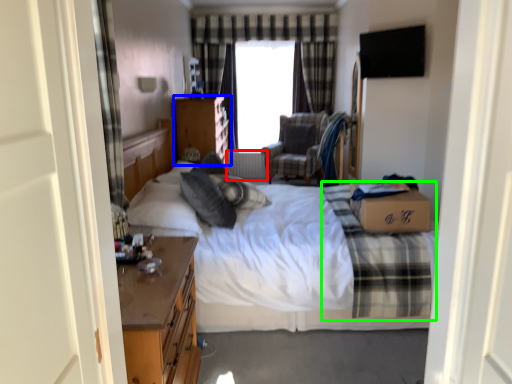
Question: Considering the real-world distances, which object is closest to radiator (highlighted by a red box)? chest of drawers (highlighted by a blue box) or plaid (highlighted by a green box).

Choices:
 (A) chest of drawers
 (B) plaid

Answer: (A)